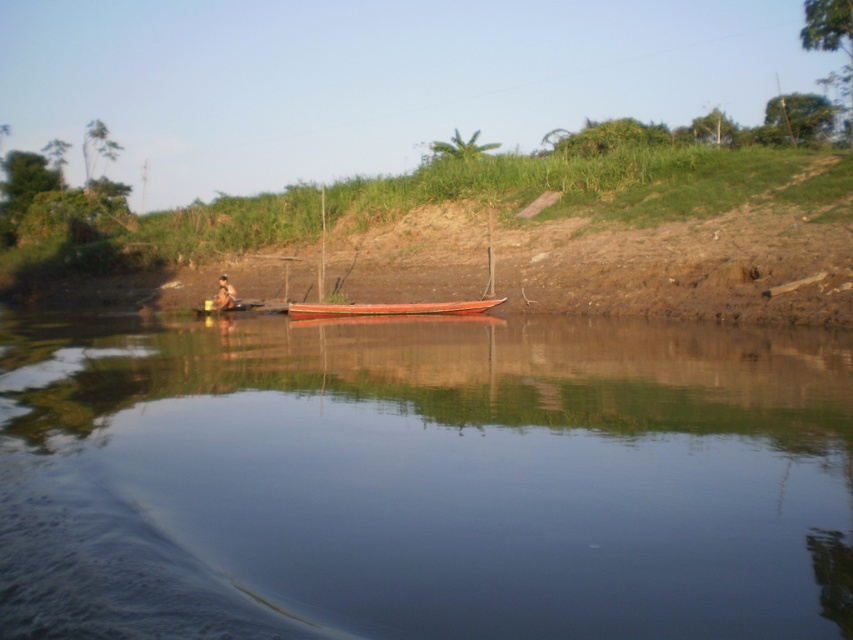
Can you confirm if smooth wooden canoe at center is wider than brown wooden person at lower left?

Indeed, smooth wooden canoe at center has a greater width compared to brown wooden person at lower left.

Image resolution: width=853 pixels, height=640 pixels. What do you see at coordinates (387, 308) in the screenshot?
I see `smooth wooden canoe at center` at bounding box center [387, 308].

This screenshot has width=853, height=640. What do you see at coordinates (387, 308) in the screenshot? I see `smooth wooden canoe at center` at bounding box center [387, 308].

Image resolution: width=853 pixels, height=640 pixels. In order to click on smooth wooden canoe at center in this screenshot , I will do `click(387, 308)`.

Does smooth water at center have a larger size compared to smooth wooden canoe at center?

Yes.

Can you confirm if smooth water at center is positioned to the left of smooth wooden canoe at center?

Yes, smooth water at center is to the left of smooth wooden canoe at center.

Locate an element on the screen. smooth water at center is located at coordinates (422, 477).

Between smooth water at center and brown wooden person at lower left, which one is positioned higher?

brown wooden person at lower left

Which is in front, point (160, 368) or point (218, 305)?

Point (160, 368) is in front.

Is point (444, 628) closer to viewer compared to point (223, 275)?

Yes, it is in front of point (223, 275).

This screenshot has width=853, height=640. Identify the location of smooth water at center. (422, 477).